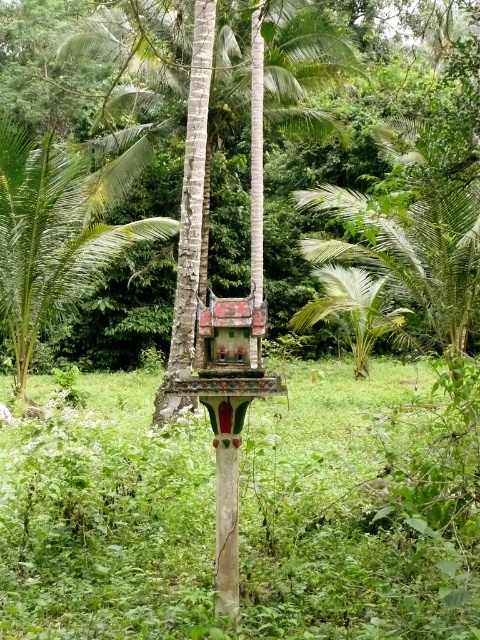
You are a gardener who wants to water both the green leafy palm tree at left and the green leafy palm tree at center. Which tree should you water first if you are standing between them?

The green leafy palm tree at left is positioned on the left side of green leafy palm tree at center, so you should water the green leafy palm tree at left first since it is closer to your left side when standing between them.

You are standing in the tropical garden and want to locate the green leafy palm tree at left. What are its coordinates?

The green leafy palm tree at left is located at coordinates point (51, 237).

You are a bird flying over the tropical garden. You see the painted wood bird feeder at center. Can you land on it? Explain why or why not based on its position.

The painted wood bird feeder at center is positioned at coordinates point (228,362). Since birds can land on structures regardless of their coordinates, yes, you can land on it as long as it is accessible and stable.